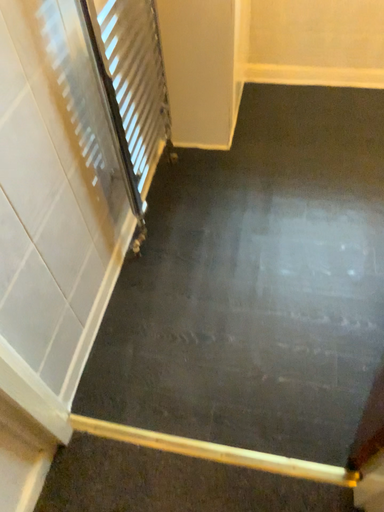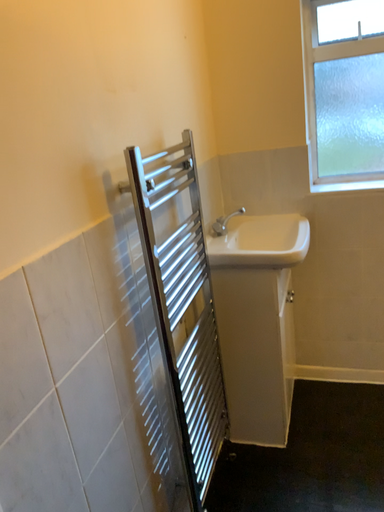
Question: Which way did the camera rotate in the video?

Choices:
 (A) rotated right
 (B) rotated left

Answer: (B)